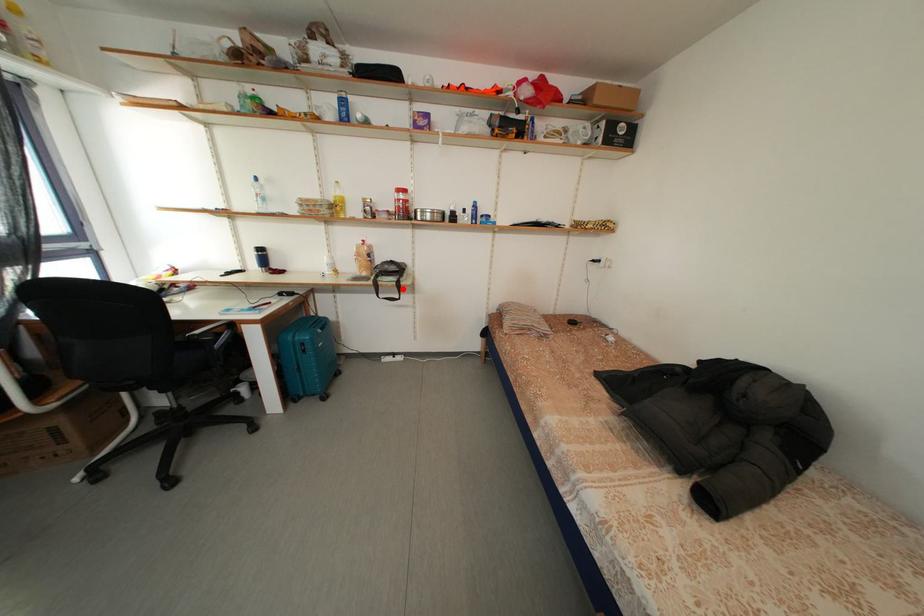
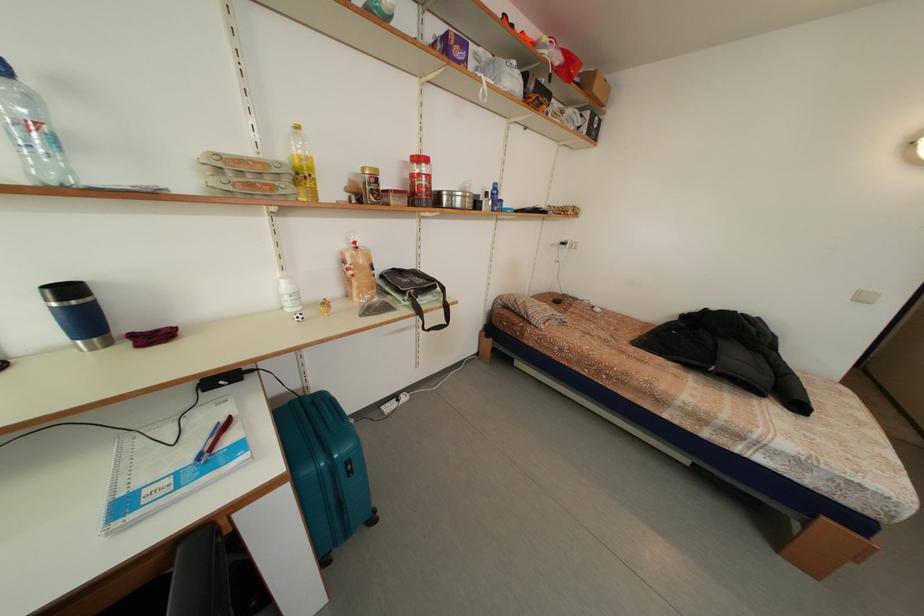
The point at the highlighted location is marked in the first image. Where is the corresponding point in the second image?

(448, 310)